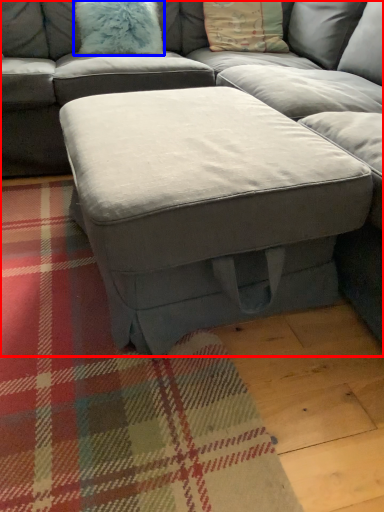
Question: Which point is closer to the camera, studio couch (highlighted by a red box) or pillow (highlighted by a blue box)?

Choices:
 (A) studio couch
 (B) pillow

Answer: (A)